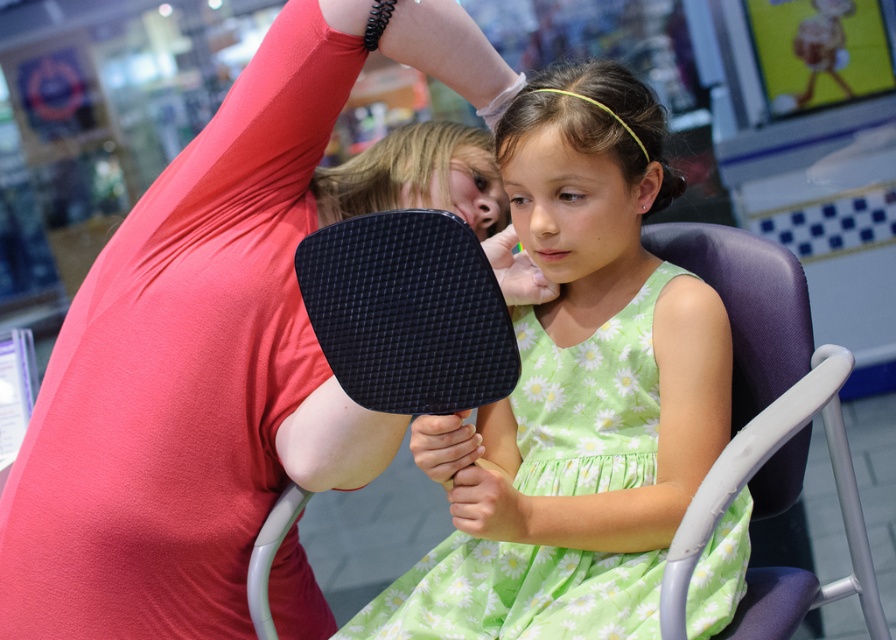
Between matte pink dress at center and green floral fabric dress at center, which one appears on the left side from the viewer's perspective?

Positioned to the left is matte pink dress at center.

You are a GUI agent. You are given a task and a screenshot of the screen. Output one action in this format:
    pyautogui.click(x=<x>, y=<y>)
    Task: Click on the matte pink dress at center
    This screenshot has width=896, height=640.
    Given the screenshot: What is the action you would take?
    pyautogui.click(x=192, y=372)

Where is `matte pink dress at center`? The image size is (896, 640). matte pink dress at center is located at coordinates (192, 372).